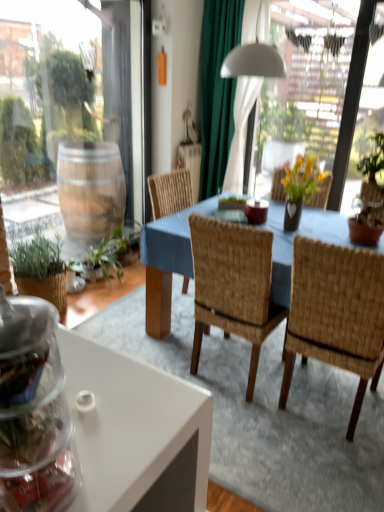
Question: Is woven wood chair at center, which is the second chair from left to right, bigger or smaller than woven wood chair at center, which is counted as the 2th chair, starting from the right?

Choices:
 (A) small
 (B) big

Answer: (B)

Question: In the image, is woven wood chair at center, the 1th chair positioned from the right, positioned in front of or behind woven wood chair at center, which is counted as the 2th chair, starting from the right?

Choices:
 (A) behind
 (B) front

Answer: (B)

Question: Which object is the closest to the transparent plastic jar at lower left?

Choices:
 (A) green fabric curtain at upper center
 (B) woven wood chair at center, which is the 1th chair from left to right
 (C) woven wood chair at center, which is the second chair from left to right

Answer: (B)

Question: Estimate the real-world distances between objects in this image. Which object is closer to the green fabric curtain at upper center?

Choices:
 (A) woven wood chair at center, which is counted as the 2th chair, starting from the right
 (B) transparent plastic jar at lower left
 (C) woven wood chair at center, the 1th chair positioned from the right

Answer: (A)